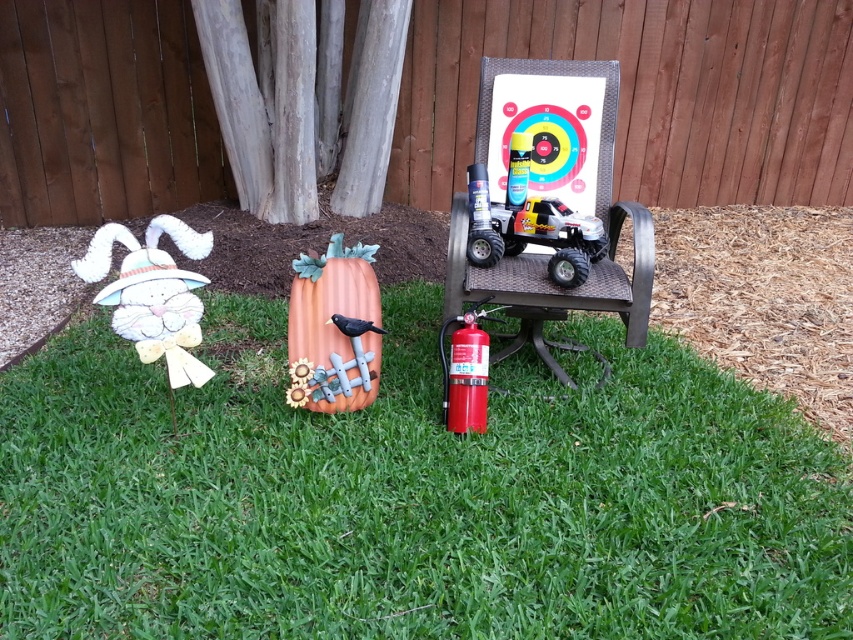
Does green grass at lower center appear on the right side of metallic red toy truck at center?

Incorrect, green grass at lower center is not on the right side of metallic red toy truck at center.

Describe the element at coordinates (410, 496) in the screenshot. I see `green grass at lower center` at that location.

The height and width of the screenshot is (640, 853). What are the coordinates of `green grass at lower center` in the screenshot? It's located at (410, 496).

Describe the element at coordinates (334, 330) in the screenshot. I see `matte pumpkin at center` at that location.

Can you confirm if matte pumpkin at center is positioned below white paper bunny at left?

Yes, matte pumpkin at center is below white paper bunny at left.

Does point (375, 248) come closer to viewer compared to point (177, 340)?

No, it is behind (177, 340).

This screenshot has height=640, width=853. I want to click on matte pumpkin at center, so click(x=334, y=330).

Does green grass at lower center appear under matte pumpkin at center?

Yes.

Who is more distant from viewer, (666, 500) or (346, 388)?

The point (346, 388) is behind.

Is point (498, 506) farther from camera compared to point (345, 298)?

No, it is in front of (345, 298).

You are a GUI agent. You are given a task and a screenshot of the screen. Output one action in this format:
    pyautogui.click(x=<x>, y=<y>)
    Task: Click on the green grass at lower center
    The height and width of the screenshot is (640, 853).
    Given the screenshot: What is the action you would take?
    pyautogui.click(x=410, y=496)